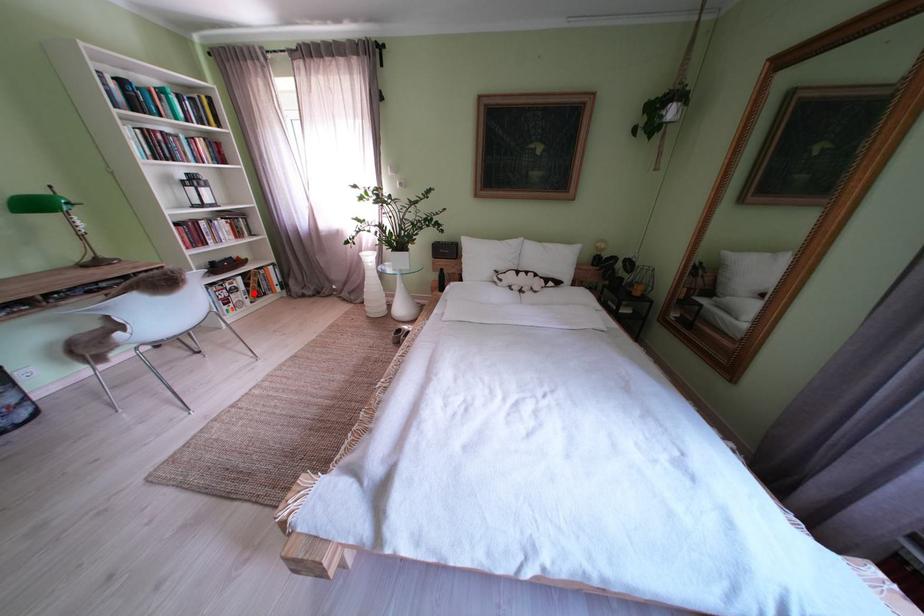
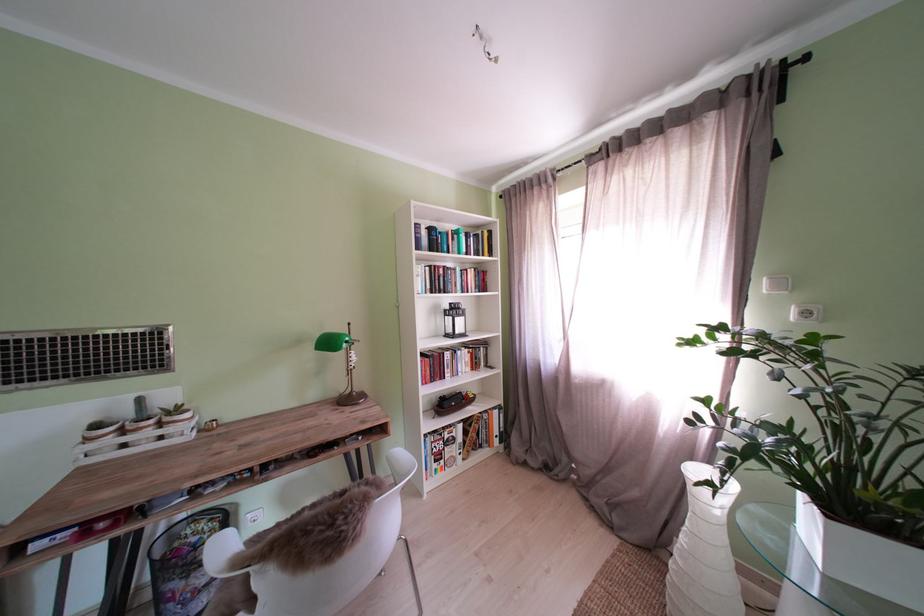
Find the pixel in the second image that matches the highlighted location in the first image.

(470, 444)